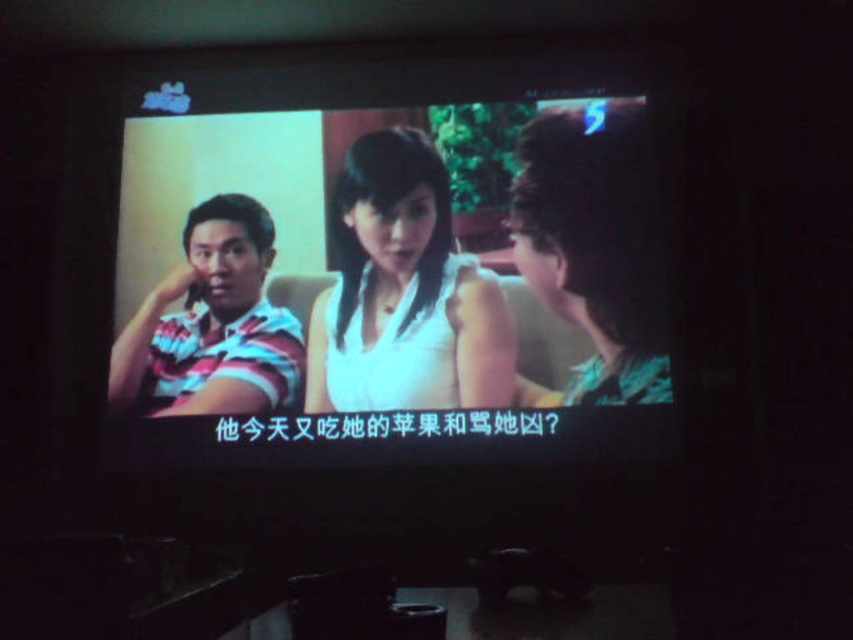
Question: Does matte white shirt at center appear under striped fabric shirt at left?

Choices:
 (A) yes
 (B) no

Answer: (B)

Question: Is matte white shirt at center bigger than white matte shirt at center?

Choices:
 (A) yes
 (B) no

Answer: (A)

Question: Which point appears closest to the camera in this image?

Choices:
 (A) (494, 276)
 (B) (265, 305)

Answer: (A)

Question: Estimate the real-world distances between objects in this image. Which object is closer to the matte white shirt at center?

Choices:
 (A) white matte shirt at center
 (B) striped fabric shirt at left

Answer: (A)

Question: Can you confirm if matte white shirt at center is positioned below white matte shirt at center?

Choices:
 (A) no
 (B) yes

Answer: (A)

Question: Which point appears farthest from the camera in this image?

Choices:
 (A) (236, 246)
 (B) (405, 244)

Answer: (A)